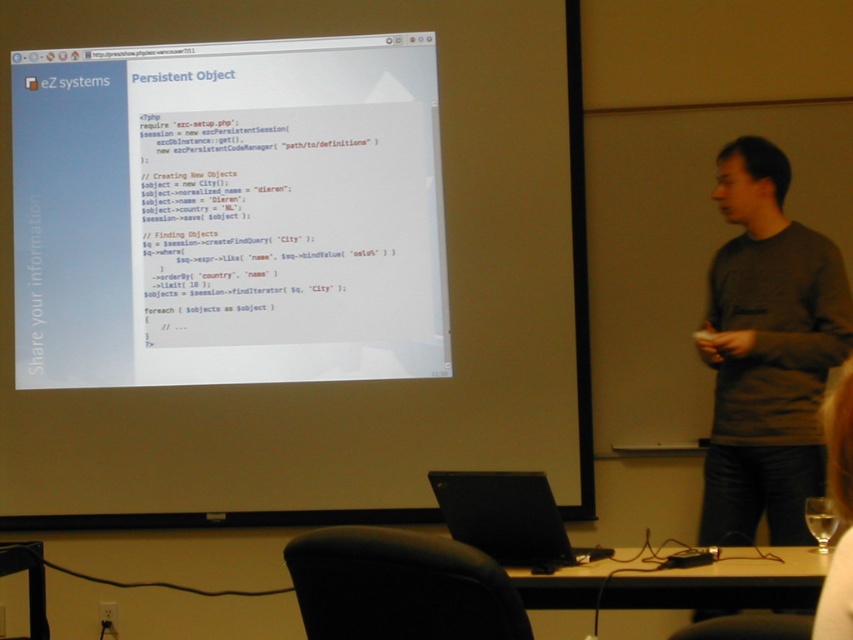
Question: Where is white paper at upper center located in relation to black matte laptop at center in the image?

Choices:
 (A) below
 (B) above

Answer: (B)

Question: Can you confirm if white paper at upper center is wider than black matte laptop at center?

Choices:
 (A) no
 (B) yes

Answer: (B)

Question: Can you confirm if black matte laptop at center is positioned above white fabric shirt at lower right?

Choices:
 (A) no
 (B) yes

Answer: (A)

Question: Based on their relative distances, which object is nearer to the black matte laptop at center?

Choices:
 (A) white paper at upper center
 (B) white fabric shirt at lower right

Answer: (B)

Question: Which object appears farthest from the camera in this image?

Choices:
 (A) white paper at upper center
 (B) white fabric shirt at lower right
 (C) black matte laptop at center

Answer: (A)

Question: Among these points, which one is nearest to the camera?

Choices:
 (A) (827, 609)
 (B) (534, 508)

Answer: (A)